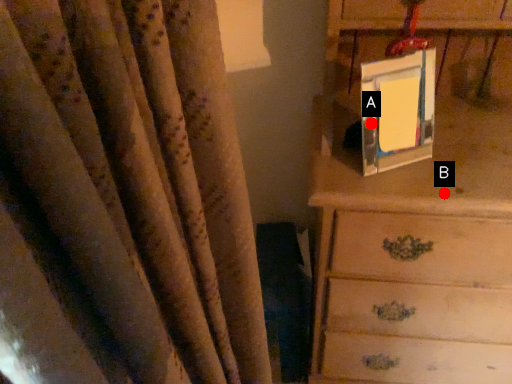
Question: Two points are circled on the image, labeled by A and B beside each circle. Which point is closer to the camera?

Choices:
 (A) A is closer
 (B) B is closer

Answer: (B)